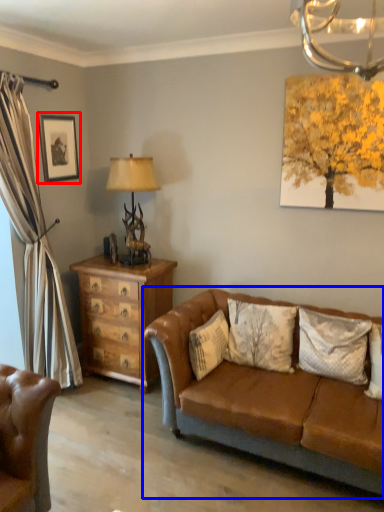
Question: Among these objects, which one is farthest to the camera, picture frame (highlighted by a red box) or studio couch (highlighted by a blue box)?

Choices:
 (A) picture frame
 (B) studio couch

Answer: (A)